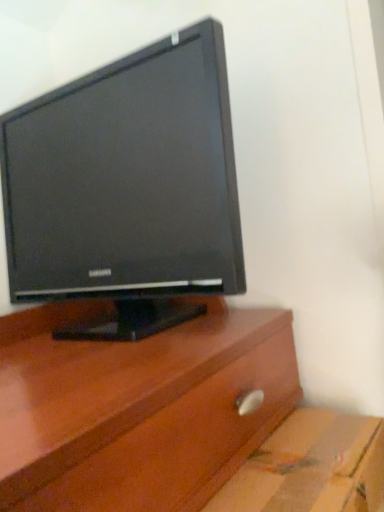
Find the location of a particular element. black glossy monitor at upper center is located at coordinates [x=127, y=187].

What do you see at coordinates (127, 187) in the screenshot?
I see `black glossy monitor at upper center` at bounding box center [127, 187].

Describe the element at coordinates (311, 467) in the screenshot. I see `cardboard at lower right` at that location.

The image size is (384, 512). In order to click on cardboard at lower right in this screenshot , I will do `click(311, 467)`.

Locate an element on the screen. This screenshot has height=512, width=384. black glossy monitor at upper center is located at coordinates (127, 187).

Considering the positions of objects cardboard at lower right and black glossy monitor at upper center in the image provided, who is more to the right, cardboard at lower right or black glossy monitor at upper center?

Positioned to the right is cardboard at lower right.

Relative to black glossy monitor at upper center, is cardboard at lower right in front or behind?

cardboard at lower right is positioned closer to the viewer than black glossy monitor at upper center.

Which is farther from the camera, [285,462] or [226,228]?

The point [226,228] is farther.

From the image's perspective, does cardboard at lower right appear lower than black glossy monitor at upper center?

Yes, from the image's perspective, cardboard at lower right is below black glossy monitor at upper center.

From a real-world perspective, is cardboard at lower right on black glossy monitor at upper center?

No, from a real-world perspective, cardboard at lower right is not on top of black glossy monitor at upper center.

Does cardboard at lower right have a greater width compared to black glossy monitor at upper center?

No.

Considering the sizes of objects cardboard at lower right and black glossy monitor at upper center in the image provided, who is taller, cardboard at lower right or black glossy monitor at upper center?

black glossy monitor at upper center is taller.

Considering the sizes of objects cardboard at lower right and black glossy monitor at upper center in the image provided, who is smaller, cardboard at lower right or black glossy monitor at upper center?

cardboard at lower right.

From the picture: Could black glossy monitor at upper center be considered to be inside cardboard at lower right?

That's incorrect, black glossy monitor at upper center is not inside cardboard at lower right.

Is cardboard at lower right positioned far away from black glossy monitor at upper center?

No, cardboard at lower right is in close proximity to black glossy monitor at upper center.

Could you tell me if cardboard at lower right is facing black glossy monitor at upper center?

No, cardboard at lower right is not facing towards black glossy monitor at upper center.

Identify the location of cardboard box below the black glossy monitor at upper center (from a real-world perspective). Image resolution: width=384 pixels, height=512 pixels. (311, 467).

Is black glossy monitor at upper center to the right of cardboard at lower right from the viewer's perspective?

In fact, black glossy monitor at upper center is to the left of cardboard at lower right.

Who is more distant, black glossy monitor at upper center or cardboard at lower right?

black glossy monitor at upper center is more distant.

Considering the points (32, 114) and (274, 446), which point is in front, point (32, 114) or point (274, 446)?

The point (274, 446) is closer to the camera.

From the image's perspective, is black glossy monitor at upper center below cardboard at lower right?

No.

From a real-world perspective, which object rests below the other?

cardboard at lower right, from a real-world perspective.

Does black glossy monitor at upper center have a lesser width compared to cardboard at lower right?

No.

Is black glossy monitor at upper center taller or shorter than cardboard at lower right?

Clearly, black glossy monitor at upper center is taller compared to cardboard at lower right.

Between black glossy monitor at upper center and cardboard at lower right, which one has larger size?

With larger size is black glossy monitor at upper center.

Would you say cardboard at lower right is part of black glossy monitor at upper center's contents?

No, black glossy monitor at upper center does not contain cardboard at lower right.

Is black glossy monitor at upper center touching cardboard at lower right?

They are not placed beside each other.

Is black glossy monitor at upper center oriented away from cardboard at lower right?

No.

In order to click on computer monitor that appears above the cardboard at lower right (from a real-world perspective) in this screenshot , I will do point(127,187).

Image resolution: width=384 pixels, height=512 pixels. Find the location of `computer monitor behind the cardboard at lower right`. computer monitor behind the cardboard at lower right is located at coordinates (127, 187).

What are the coordinates of `computer monitor that is above the cardboard at lower right (from the image's perspective)` in the screenshot? It's located at [127, 187].